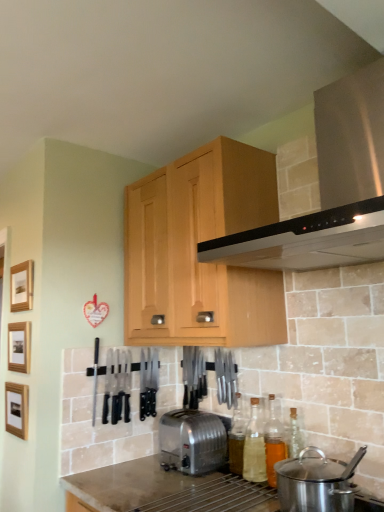
Image resolution: width=384 pixels, height=512 pixels. Find the location of `vacant area on top of stainless steel range hood at upper center (from a real-world perspective)`. vacant area on top of stainless steel range hood at upper center (from a real-world perspective) is located at coordinates point(296,57).